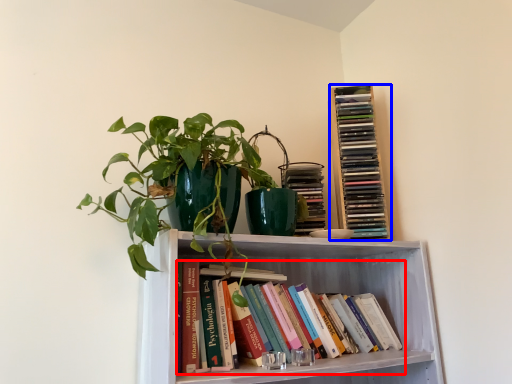
Question: Which object is closer to the camera taking this photo, book (highlighted by a red box) or book (highlighted by a blue box)?

Choices:
 (A) book
 (B) book

Answer: (A)